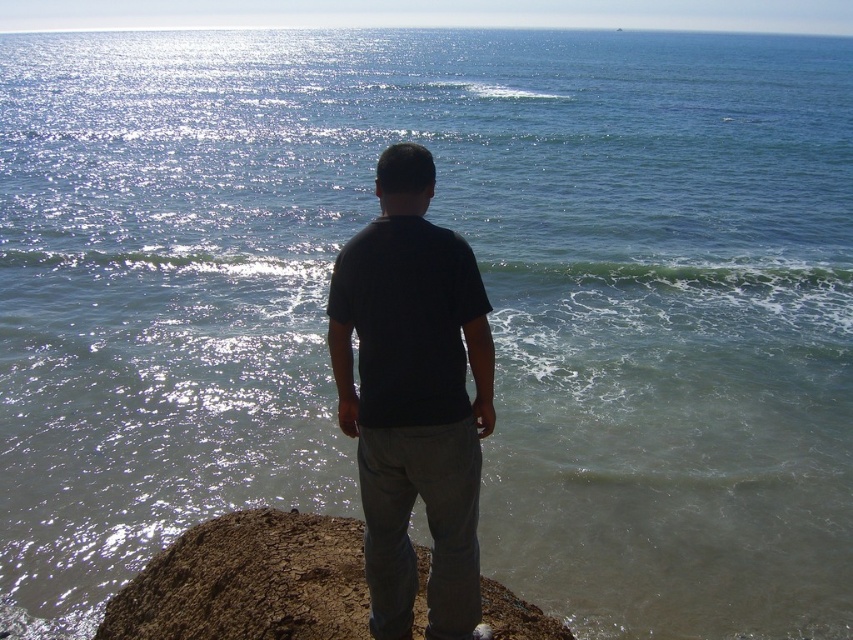
Measure the distance between dark matte shirt at center and camera.

4.64 meters

Does dark matte shirt at center appear on the left side of dull brown dirt at center?

In fact, dark matte shirt at center is to the right of dull brown dirt at center.

The image size is (853, 640). In order to click on dark matte shirt at center in this screenshot , I will do `click(413, 397)`.